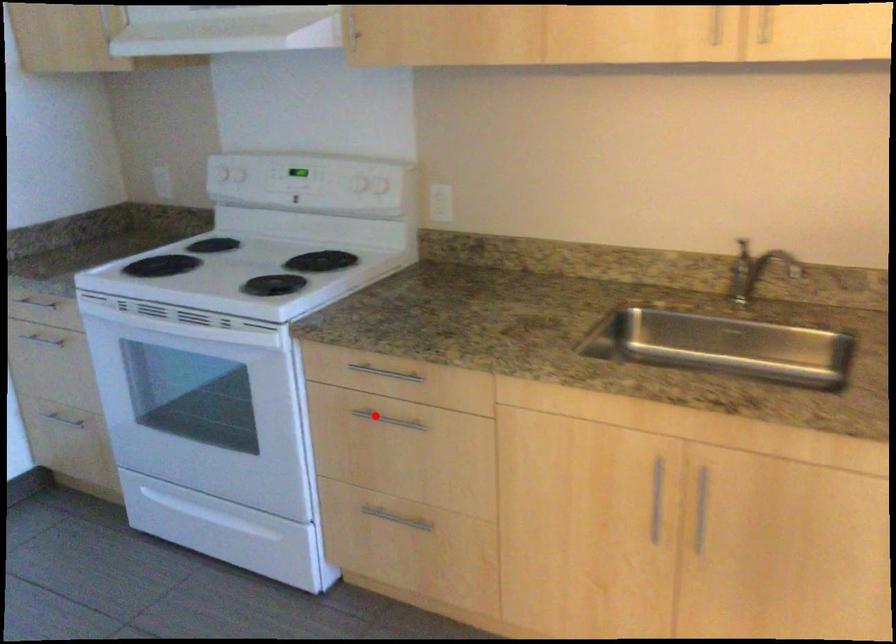
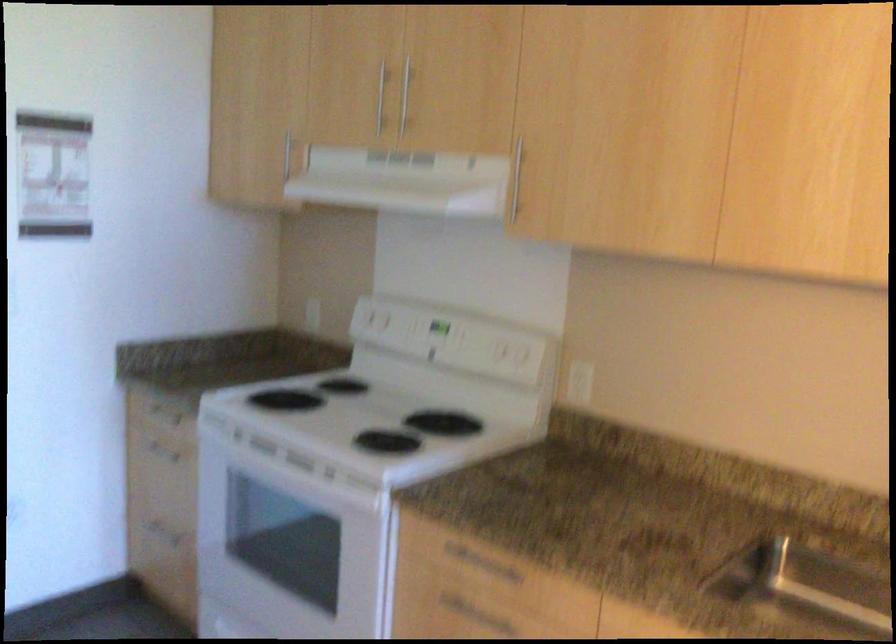
Question: I am providing you with two images of the same scene from different viewpoints. Given a red point in image1, look at the same physical point in image2. Is it:

Choices:
 (A) Closer to the viewpoint
 (B) Farther from the viewpoint

Answer: (A)